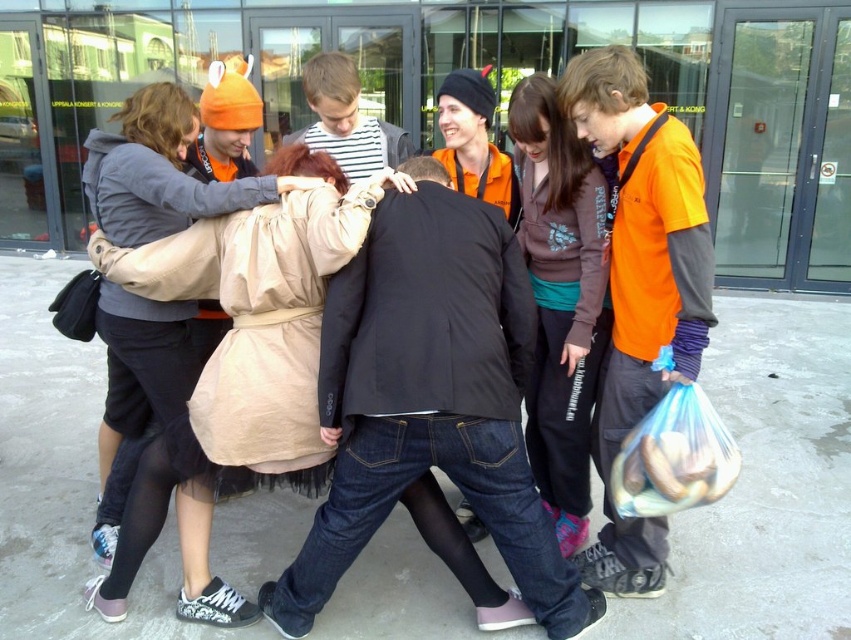
In the scene shown: You are a photographer standing in front of the group. You need to take a photo that includes both the beige fabric coat at left and the brown fleece jacket at center. Based on their positions, which one should you adjust your camera angle to focus on first to ensure both are in frame?

The beige fabric coat at left is located below the brown fleece jacket at center. To include both in the frame, you should first focus on the brown fleece jacket at center and then adjust the angle downward to include the beige fabric coat at left.

Based on the photo, you are organizing a small event and need to place a beige fabric coat at left and a translucent plastic bag at lower right on a narrow shelf. Which object should you place first to ensure both fit without overlapping?

The beige fabric coat at left is wider than the translucent plastic bag at lower right. Place the wider beige fabric coat at left first, then the narrower translucent plastic bag at lower right to fit both without overlapping.

You are standing in front of the group of seven people in the image. There are two points marked in the scene. The first point is at coordinate position (187,364) and the second point is at coordinate position (687,404). Which point is closer to you?

The point at coordinate position (187,364) is closer to you because it is further to the camera than the point at coordinate position (687,404).